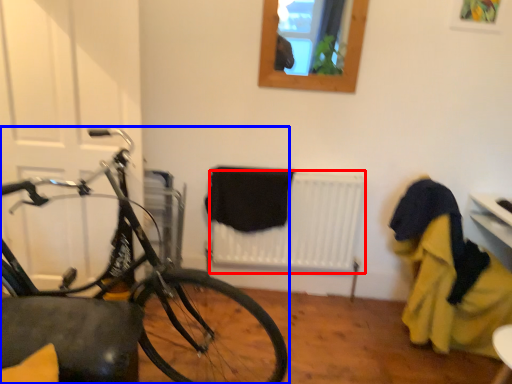
Question: Among these objects, which one is nearest to the camera, radiator (highlighted by a red box) or bicycle (highlighted by a blue box)?

Choices:
 (A) radiator
 (B) bicycle

Answer: (B)